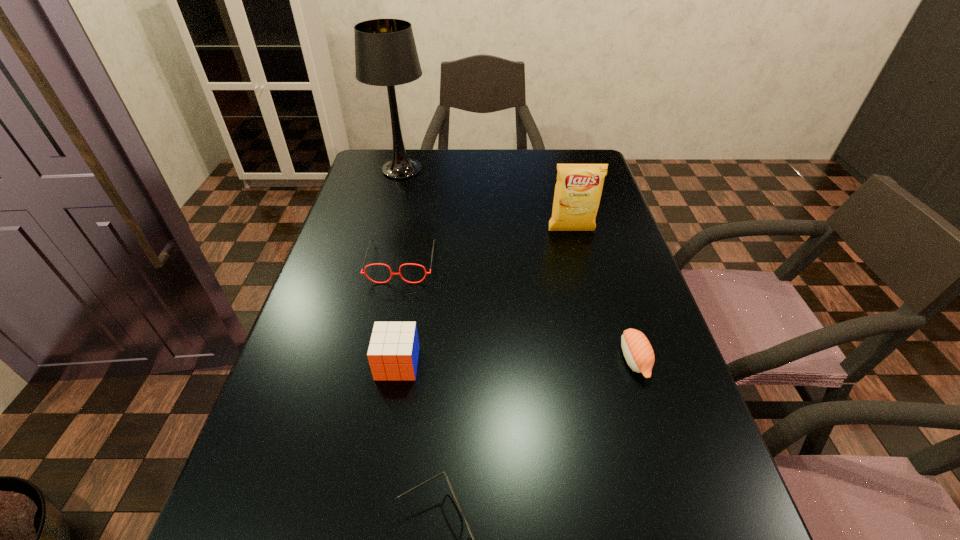
At what (x,y) coordinates should I click in order to perform the action: click on table lamp. Please return your answer as a coordinate pair (x, y). Looking at the image, I should click on pos(385,51).

Where is `the farthest object`? Image resolution: width=960 pixels, height=540 pixels. the farthest object is located at coordinates (385, 51).

Find the location of a particular element. crisp (potato chip) is located at coordinates (578, 189).

Where is `the fifth nearest object`? The image size is (960, 540). the fifth nearest object is located at coordinates (578, 189).

Locate an element on the screen. The image size is (960, 540). cube is located at coordinates (393, 352).

Find the location of a particular element. The width and height of the screenshot is (960, 540). the taller spectacles is located at coordinates (364, 272).

Find the location of a particular element. This screenshot has width=960, height=540. the farther spectacles is located at coordinates (364, 272).

You are a GUI agent. You are given a task and a screenshot of the screen. Output one action in this format:
    pyautogui.click(x=<x>, y=<y>)
    Task: Click on the sushi
    Image resolution: width=960 pixels, height=540 pixels.
    Given the screenshot: What is the action you would take?
    pyautogui.click(x=637, y=350)

Locate an element on the screen. free space located on the right of the table lamp is located at coordinates (520, 170).

What are the coordinates of `vacant space positioned on the front of the second farthest object with the logo` in the screenshot? It's located at (589, 305).